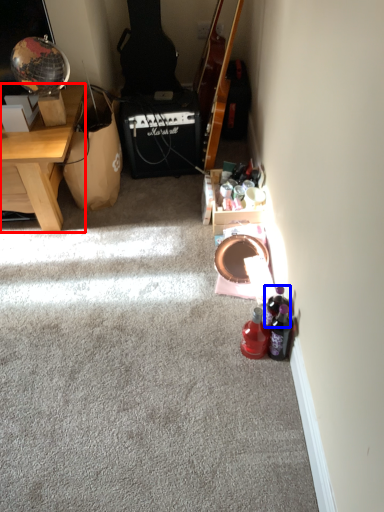
Question: Which of the following is the farthest to the observer, desk (highlighted by a red box) or bottle (highlighted by a blue box)?

Choices:
 (A) desk
 (B) bottle

Answer: (A)